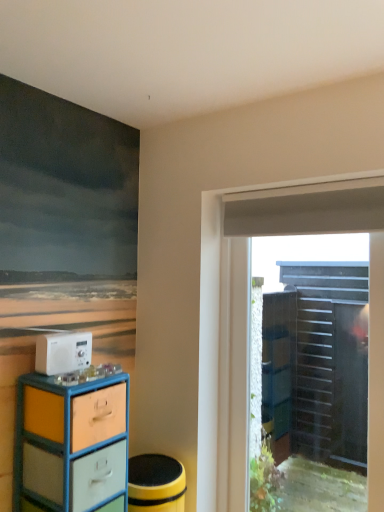
Describe the element at coordinates (71, 442) in the screenshot. I see `matte plastic chest of drawers at left` at that location.

Where is `matte plastic chest of drawers at left`? This screenshot has width=384, height=512. matte plastic chest of drawers at left is located at coordinates (71, 442).

From their relative heights in the image, would you say transparent plastic door at right is taller or shorter than matte plastic chest of drawers at left?

Considering their sizes, transparent plastic door at right has more height than matte plastic chest of drawers at left.

From a real-world perspective, is transparent plastic door at right physically above matte plastic chest of drawers at left?

Yes, from a real-world perspective, transparent plastic door at right is on top of matte plastic chest of drawers at left.

Is transparent plastic door at right further to the viewer compared to white plastic radio at lower left?

Yes, transparent plastic door at right is further from the camera.

Is transparent plastic door at right aimed at white plastic radio at lower left?

No, transparent plastic door at right is not turned towards white plastic radio at lower left.

Is transparent plastic door at right placed right next to white plastic radio at lower left?

No, transparent plastic door at right is not next to white plastic radio at lower left.

In the scene shown: Is white plastic radio at lower left located within transparent plastic door at right?

That's incorrect, white plastic radio at lower left is not inside transparent plastic door at right.

Is matte plastic chest of drawers at left facing away from white plastic radio at lower left?

No.

Is matte plastic chest of drawers at left next to white plastic radio at lower left?

No.

Where is `the chest of drawers beneath the white plastic radio at lower left (from a real-world perspective)`? the chest of drawers beneath the white plastic radio at lower left (from a real-world perspective) is located at coordinates (71, 442).

From the image's perspective, between matte plastic chest of drawers at left and white plastic radio at lower left, which one is located above?

white plastic radio at lower left, from the image's perspective.

Does white plastic radio at lower left have a greater height compared to matte plastic chest of drawers at left?

Incorrect, the height of white plastic radio at lower left is not larger of that of matte plastic chest of drawers at left.

Does white plastic radio at lower left appear on the left side of matte plastic chest of drawers at left?

Correct, you'll find white plastic radio at lower left to the left of matte plastic chest of drawers at left.

At what (x,y) coordinates should I click in order to perform the action: click on chest of drawers below the white plastic radio at lower left (from the image's perspective). Please return your answer as a coordinate pair (x, y). This screenshot has width=384, height=512. Looking at the image, I should click on (71, 442).

From a real-world perspective, is white plastic radio at lower left located beneath transparent plastic door at right?

No, from a real-world perspective, white plastic radio at lower left is not beneath transparent plastic door at right.

Looking at the image, does white plastic radio at lower left seem bigger or smaller compared to transparent plastic door at right?

Considering their sizes, white plastic radio at lower left takes up less space than transparent plastic door at right.

Which object is more forward, white plastic radio at lower left or transparent plastic door at right?

white plastic radio at lower left is in front.

Locate an element on the screen. The image size is (384, 512). appliance that appears above the transparent plastic door at right (from a real-world perspective) is located at coordinates (63, 353).

How different are the orientations of matte plastic chest of drawers at left and transparent plastic door at right in degrees?

89.6 degrees.

Between matte plastic chest of drawers at left and transparent plastic door at right, which one is positioned in front?

matte plastic chest of drawers at left is in front.

Is matte plastic chest of drawers at left in contact with transparent plastic door at right?

No.

Locate an element on the screen. This screenshot has height=512, width=384. chest of drawers below the transparent plastic door at right (from the image's perspective) is located at coordinates (71, 442).

The image size is (384, 512). I want to click on appliance on the left of transparent plastic door at right, so click(x=63, y=353).

Considering their positions, is white plastic radio at lower left positioned further to matte plastic chest of drawers at left than transparent plastic door at right?

transparent plastic door at right lies further to matte plastic chest of drawers at left than the other object.

Estimate the real-world distances between objects in this image. Which object is closer to white plastic radio at lower left, matte plastic chest of drawers at left or transparent plastic door at right?

matte plastic chest of drawers at left.

When comparing their distances from transparent plastic door at right, does white plastic radio at lower left or matte plastic chest of drawers at left seem further?

white plastic radio at lower left is further to transparent plastic door at right.

When comparing their distances from transparent plastic door at right, does matte plastic chest of drawers at left or white plastic radio at lower left seem closer?

matte plastic chest of drawers at left lies closer to transparent plastic door at right than the other object.

When comparing their distances from white plastic radio at lower left, does transparent plastic door at right or matte plastic chest of drawers at left seem further?

transparent plastic door at right lies further to white plastic radio at lower left than the other object.

From the image, which object appears to be farther from matte plastic chest of drawers at left, transparent plastic door at right or white plastic radio at lower left?

transparent plastic door at right is positioned further to the anchor matte plastic chest of drawers at left.

Locate an element on the screen. chest of drawers between white plastic radio at lower left and transparent plastic door at right from left to right is located at coordinates (71, 442).